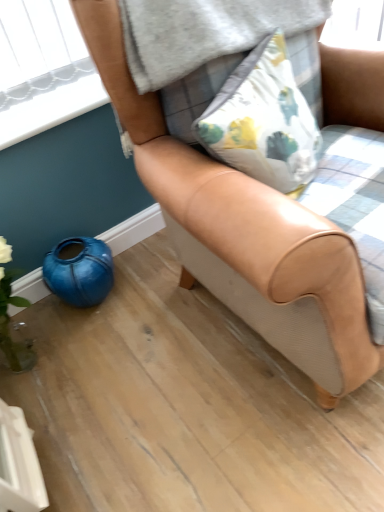
Describe the element at coordinates (244, 233) in the screenshot. I see `tan leather chair at center` at that location.

Where is `tan leather chair at center`? The height and width of the screenshot is (512, 384). tan leather chair at center is located at coordinates (244, 233).

You are a GUI agent. You are given a task and a screenshot of the screen. Output one action in this format:
    pyautogui.click(x=<x>, y=<y>)
    Task: Click on the tan leather chair at center
    This screenshot has width=384, height=512.
    Given the screenshot: What is the action you would take?
    pyautogui.click(x=244, y=233)